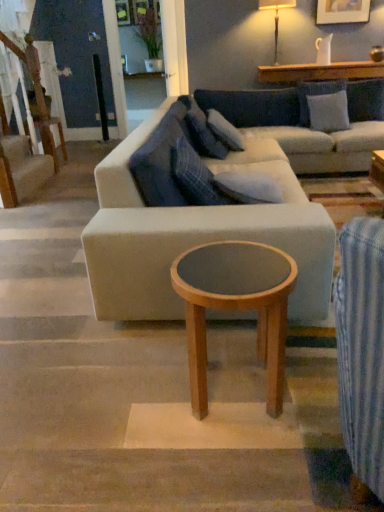
Where is `free space in front of light brown wood coffee table at center`? free space in front of light brown wood coffee table at center is located at coordinates (238, 467).